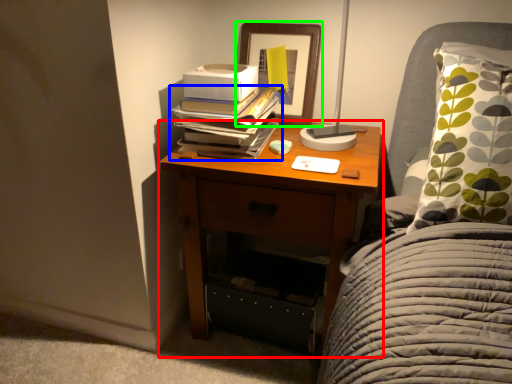
Question: Based on their relative distances, which object is farther from nightstand (highlighted by a red box)? Choose from book (highlighted by a blue box) and picture frame (highlighted by a green box).

Choices:
 (A) book
 (B) picture frame

Answer: (B)